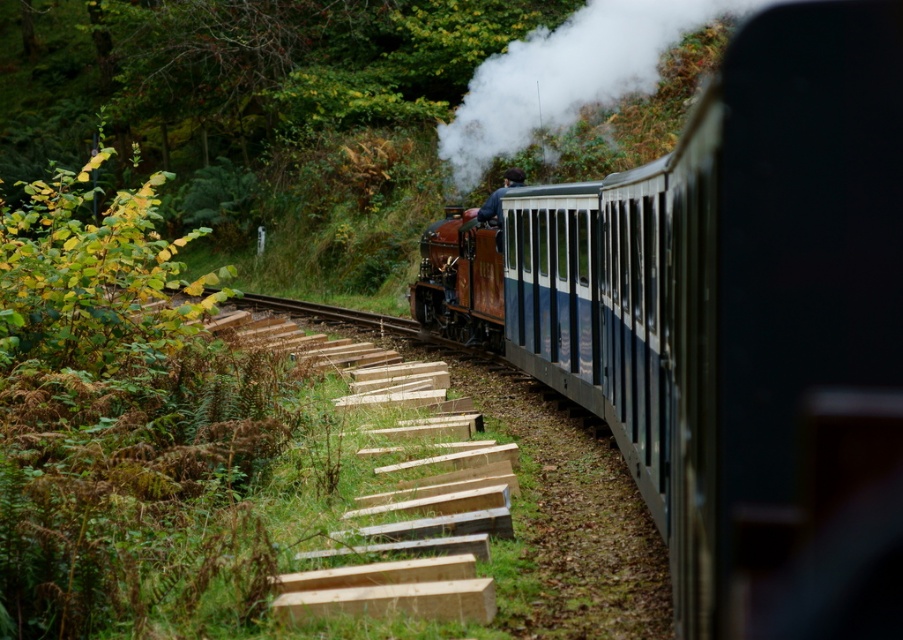
You are a passenger on the train and want to take a photo of the blue polished wood train at center and the white smoke at upper center through the window. Can you fit both objects in the frame of your camera, which has a maximum field of view of 30 feet?

The blue polished wood train at center and white smoke at upper center are 32.02 feet apart from each other. Since the camera can only capture a maximum of 30 feet, both objects cannot be captured in a single frame.

You are a passenger sitting in the vintage steam locomotive. You look out the window and see a point at coordinates [566,74]. What object is this point located on?

The point at coordinates [566,74] is located on the white smoke at upper center.